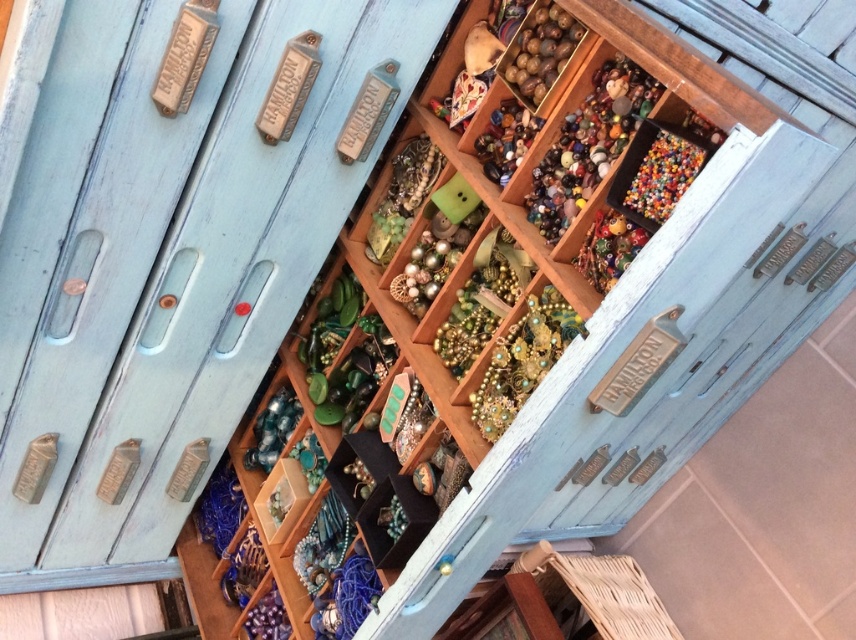
You are organizing a craft fair and need to display two items from the cabinet. You have a wooden jewelry box at center and translucent glass beads at center. Which item should you choose to place on a shelf that requires a taller object?

The wooden jewelry box at center is much taller than the translucent glass beads at center, so you should choose the wooden jewelry box at center for the shelf requiring a taller object.